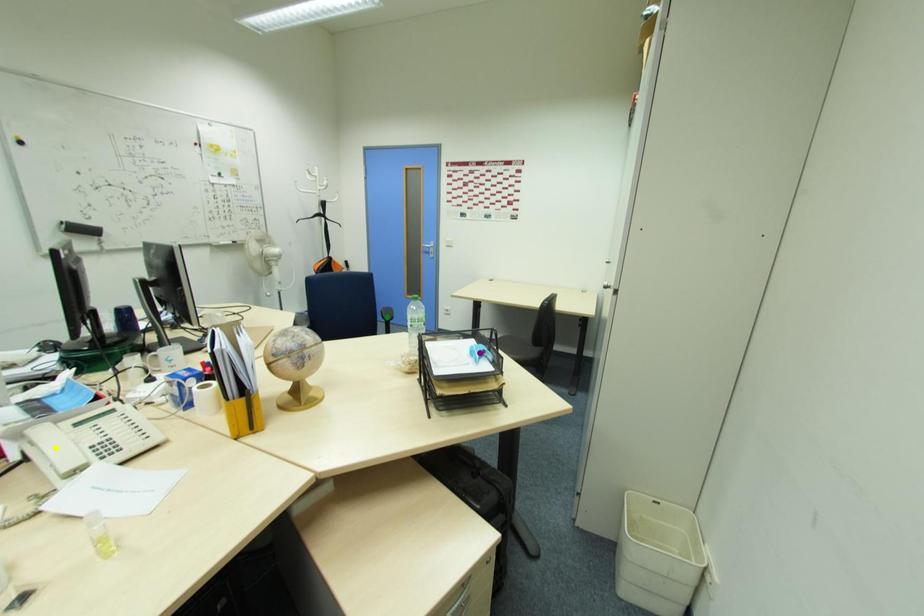
Order these from nearest to farthest:
green point, purple point, yellow point

yellow point, purple point, green point